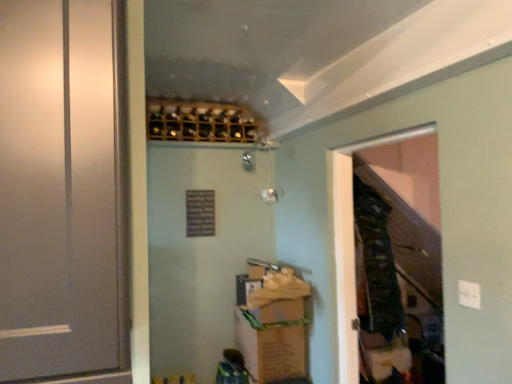
This screenshot has height=384, width=512. Describe the element at coordinates (352, 241) in the screenshot. I see `wooden screen door at right` at that location.

The width and height of the screenshot is (512, 384). In order to click on camouflage fabric laundry at right in this screenshot , I will do `click(377, 264)`.

Which is more to the right, white matte door at left or wooden screen door at right?

wooden screen door at right is more to the right.

Considering the relative sizes of white matte door at left and wooden screen door at right in the image provided, is white matte door at left bigger than wooden screen door at right?

Correct, white matte door at left is larger in size than wooden screen door at right.

Relative to wooden screen door at right, is white matte door at left in front or behind?

white matte door at left is positioned closer to the viewer than wooden screen door at right.

In terms of width, does brown cardboard box at lower center look wider or thinner when compared to wooden wine rack at upper center?

Considering their sizes, brown cardboard box at lower center looks broader than wooden wine rack at upper center.

Considering the relative sizes of brown cardboard box at lower center and wooden wine rack at upper center in the image provided, is brown cardboard box at lower center bigger than wooden wine rack at upper center?

Correct, brown cardboard box at lower center is larger in size than wooden wine rack at upper center.

Measure the distance between brown cardboard box at lower center and wooden wine rack at upper center.

brown cardboard box at lower center and wooden wine rack at upper center are 4.29 feet apart.

Between brown cardboard box at lower center and wooden wine rack at upper center, which one has more height?

Standing taller between the two is brown cardboard box at lower center.

Who is more distant, camouflage fabric laundry at right or wooden screen door at right?

camouflage fabric laundry at right.

Is camouflage fabric laundry at right not near wooden screen door at right?

camouflage fabric laundry at right is actually quite close to wooden screen door at right.

From the image's perspective, is camouflage fabric laundry at right below wooden screen door at right?

No, from the image's perspective, camouflage fabric laundry at right is not below wooden screen door at right.

From a real-world perspective, who is located lower, wooden screen door at right or white matte door at left?

wooden screen door at right is physically lower.

From the image's perspective, between wooden screen door at right and white matte door at left, who is located below?

wooden screen door at right is shown below in the image.

Who is more distant, wooden screen door at right or white matte door at left?

wooden screen door at right.

Is wooden screen door at right oriented towards white matte door at left?

Answer: No, wooden screen door at right does not turn towards white matte door at left.

Is wooden screen door at right far from camouflage fabric laundry at right?

No, wooden screen door at right is not far away from camouflage fabric laundry at right.

Looking at their sizes, would you say wooden screen door at right is wider or thinner than camouflage fabric laundry at right?

In the image, wooden screen door at right appears to be more narrow than camouflage fabric laundry at right.

Considering the sizes of wooden screen door at right and camouflage fabric laundry at right in the image, is wooden screen door at right bigger or smaller than camouflage fabric laundry at right?

Clearly, wooden screen door at right is smaller in size than camouflage fabric laundry at right.

Is wooden screen door at right turned away from camouflage fabric laundry at right?

Correct, wooden screen door at right is looking away from camouflage fabric laundry at right.

Who is smaller, wooden wine rack at upper center or camouflage fabric laundry at right?

Smaller between the two is wooden wine rack at upper center.

Is wooden wine rack at upper center next to camouflage fabric laundry at right and touching it?

No, wooden wine rack at upper center is not in contact with camouflage fabric laundry at right.

Would you say wooden wine rack at upper center is inside or outside camouflage fabric laundry at right?

wooden wine rack at upper center cannot be found inside camouflage fabric laundry at right.

Is wooden wine rack at upper center oriented away from camouflage fabric laundry at right?

That's not correct — wooden wine rack at upper center is not looking away from camouflage fabric laundry at right.

Looking at this image, does white matte door at left have a greater height compared to camouflage fabric laundry at right?

Incorrect, the height of white matte door at left is not larger of that of camouflage fabric laundry at right.

From a real-world perspective, who is located lower, white matte door at left or camouflage fabric laundry at right?

In real-world perspective, camouflage fabric laundry at right is lower.

Considering the relative sizes of white matte door at left and camouflage fabric laundry at right in the image provided, is white matte door at left thinner than camouflage fabric laundry at right?

No, white matte door at left is not thinner than camouflage fabric laundry at right.

Is white matte door at left inside the boundaries of camouflage fabric laundry at right, or outside?

The correct answer is: outside.

In order to click on screen door behind the white matte door at left in this screenshot , I will do `click(352, 241)`.

Locate an element on the screen. cardboard box lying below the wooden wine rack at upper center (from the image's perspective) is located at coordinates (273, 340).

From the image, which object appears to be farther from white matte door at left, camouflage fabric laundry at right or brown cardboard box at lower center?

Among the two, camouflage fabric laundry at right is located further to white matte door at left.

Looking at the image, which one is located closer to camouflage fabric laundry at right, brown cardboard box at lower center or wooden wine rack at upper center?

brown cardboard box at lower center is positioned closer to the anchor camouflage fabric laundry at right.

Looking at the image, which one is located closer to camouflage fabric laundry at right, wooden wine rack at upper center or white matte door at left?

Among the two, wooden wine rack at upper center is located nearer to camouflage fabric laundry at right.

From the image, which object appears to be nearer to wooden screen door at right, camouflage fabric laundry at right or wooden wine rack at upper center?

camouflage fabric laundry at right is closer to wooden screen door at right.

When comparing their distances from brown cardboard box at lower center, does white matte door at left or wooden screen door at right seem further?

white matte door at left lies further to brown cardboard box at lower center than the other object.

Which object lies further to the anchor point camouflage fabric laundry at right, wooden screen door at right or wooden wine rack at upper center?

wooden wine rack at upper center is positioned further to the anchor camouflage fabric laundry at right.

Looking at this image, when comparing their distances from wooden screen door at right, does brown cardboard box at lower center or camouflage fabric laundry at right seem further?

brown cardboard box at lower center.

Based on their spatial positions, is brown cardboard box at lower center or white matte door at left further from wooden wine rack at upper center?

Among the two, white matte door at left is located further to wooden wine rack at upper center.

This screenshot has width=512, height=384. I want to click on cardboard box between white matte door at left and wooden wine rack at upper center in the front-back direction, so click(273, 340).

In order to click on laundry between white matte door at left and brown cardboard box at lower center in the front-back direction in this screenshot , I will do `click(377, 264)`.

I want to click on laundry positioned between white matte door at left and wooden wine rack at upper center from near to far, so click(377, 264).

The width and height of the screenshot is (512, 384). I want to click on screen door between white matte door at left and camouflage fabric laundry at right along the z-axis, so click(x=352, y=241).